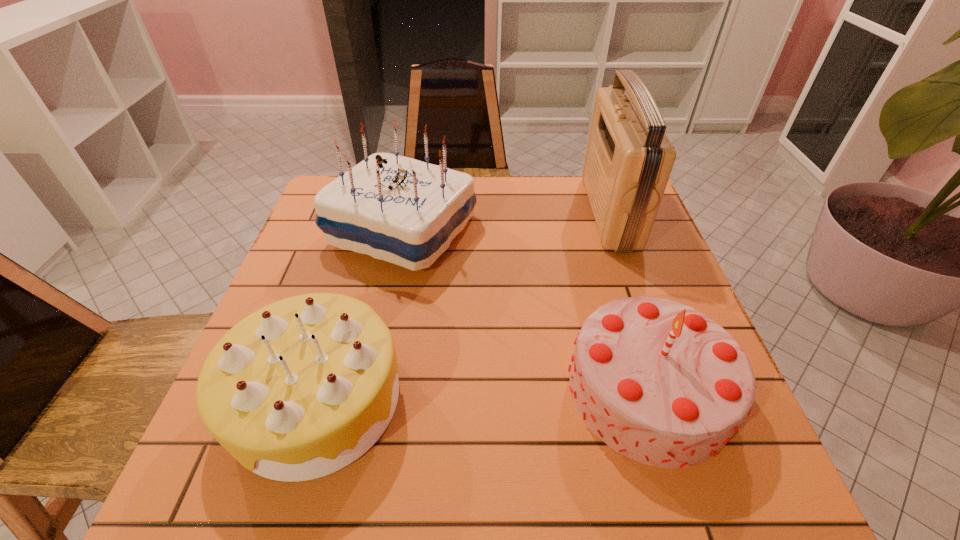
This screenshot has width=960, height=540. What are the coordinates of `the tallest object` in the screenshot? It's located at (628, 161).

The width and height of the screenshot is (960, 540). In order to click on the tallest birthday cake in this screenshot , I will do `click(398, 209)`.

Locate an element on the screen. the third shortest object is located at coordinates (398, 209).

Identify the location of the second tallest birthday cake. (659, 382).

The width and height of the screenshot is (960, 540). Find the location of `the rightmost birthday cake`. the rightmost birthday cake is located at coordinates (659, 382).

Image resolution: width=960 pixels, height=540 pixels. In order to click on the shortest object in this screenshot , I will do `click(299, 389)`.

Where is `vacant position located 0.290m on the front-facing side of the tallest object`? This screenshot has width=960, height=540. vacant position located 0.290m on the front-facing side of the tallest object is located at coordinates (484, 212).

Locate an element on the screen. This screenshot has width=960, height=540. free spot located 0.200m on the front-facing side of the tallest object is located at coordinates (516, 212).

Where is `vacant area located 0.090m on the front-facing side of the tallest object`? vacant area located 0.090m on the front-facing side of the tallest object is located at coordinates (556, 212).

Where is `vacant space located 0.170m on the right of the second tallest object`? The width and height of the screenshot is (960, 540). vacant space located 0.170m on the right of the second tallest object is located at coordinates (541, 232).